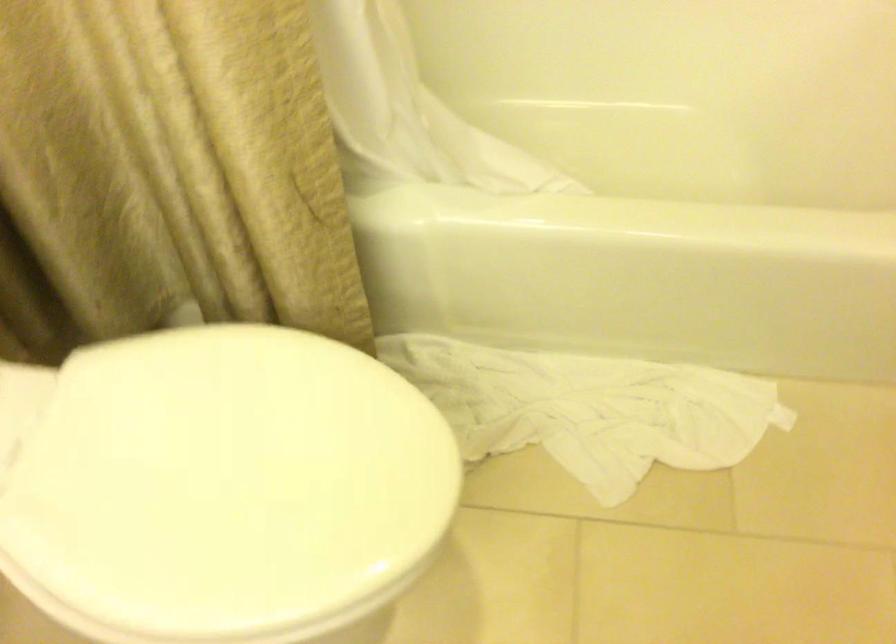
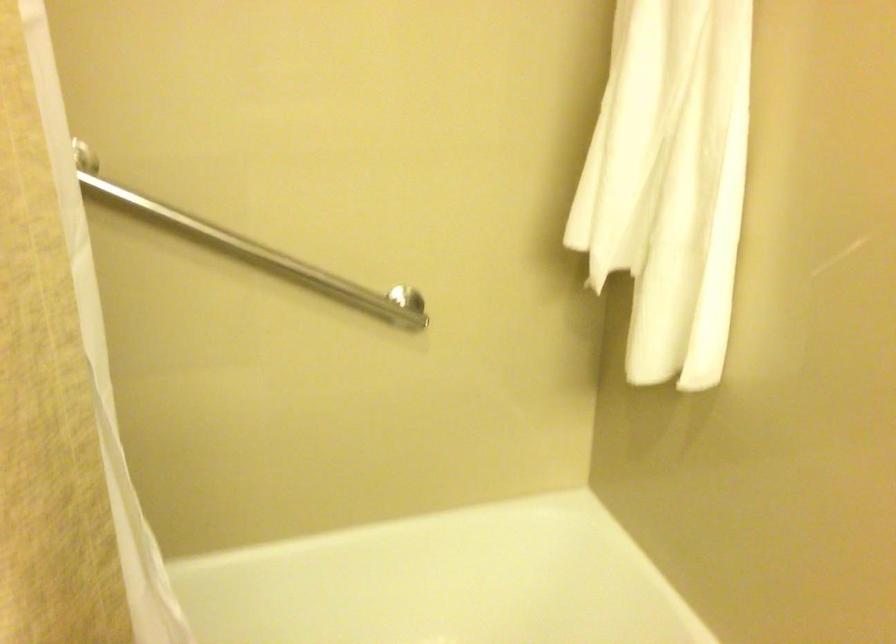
How did the camera likely rotate?

The rotation direction of the camera is right-up.